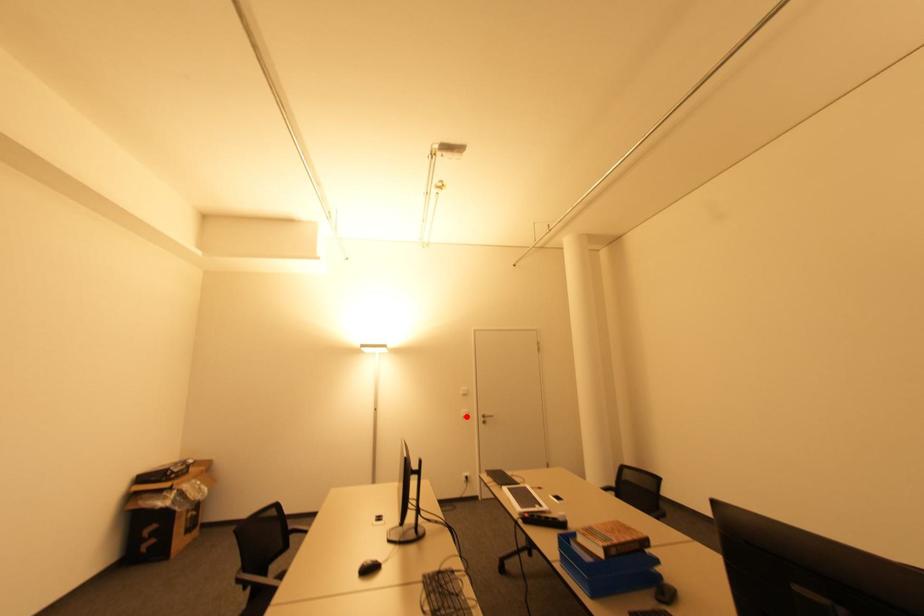
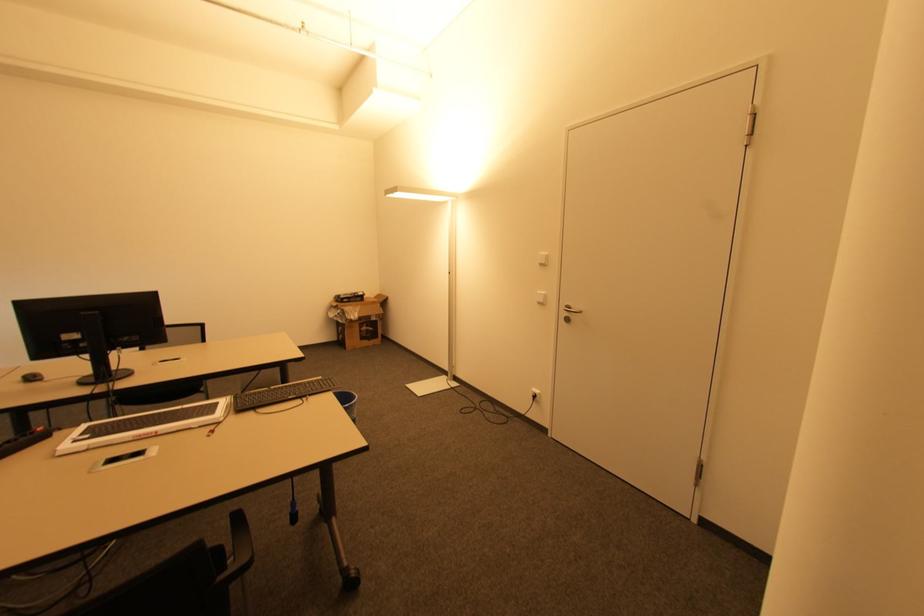
Question: I am providing you with two images of the same scene from different viewpoints. Image1 has a red point marked. In image2, the corresponding 3D location appears at what relative position? Reply with the corresponding letter.

Choices:
 (A) Closer
 (B) Farther

Answer: (A)